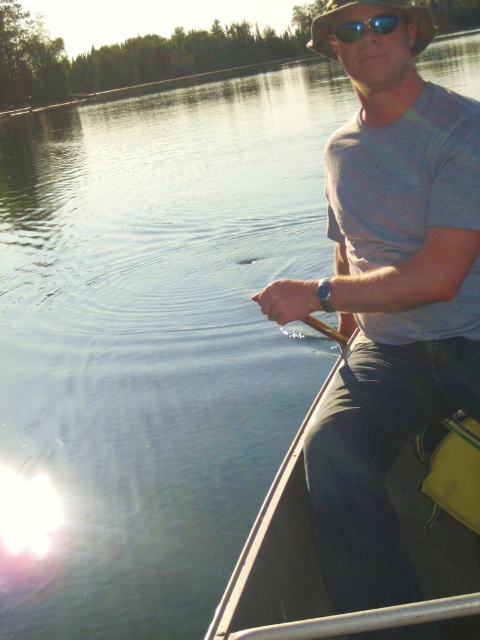
Is smooth gray canoe at right smaller than blue reflective lens sunglasses at upper center?

Incorrect, smooth gray canoe at right is not smaller in size than blue reflective lens sunglasses at upper center.

Which is below, smooth gray canoe at right or blue reflective lens sunglasses at upper center?

smooth gray canoe at right is below.

I want to click on smooth gray canoe at right, so click(277, 552).

Identify the location of smooth gray canoe at right. (277, 552).

Is point (465, 268) farther from camera compared to point (415, 490)?

No, (465, 268) is in front of (415, 490).

What do you see at coordinates (388, 294) in the screenshot? I see `gray cotton t-shirt at upper right` at bounding box center [388, 294].

Locate an element on the screen. This screenshot has width=480, height=640. gray cotton t-shirt at upper right is located at coordinates (388, 294).

Which is behind, point (454, 186) or point (337, 35)?

Positioned behind is point (337, 35).

Between gray cotton t-shirt at upper right and blue reflective lens sunglasses at upper center, which one has less height?

With less height is blue reflective lens sunglasses at upper center.

Which is in front, point (415, 394) or point (338, 13)?

Positioned in front is point (338, 13).

Identify the location of gray cotton t-shirt at upper right. The height and width of the screenshot is (640, 480). (388, 294).